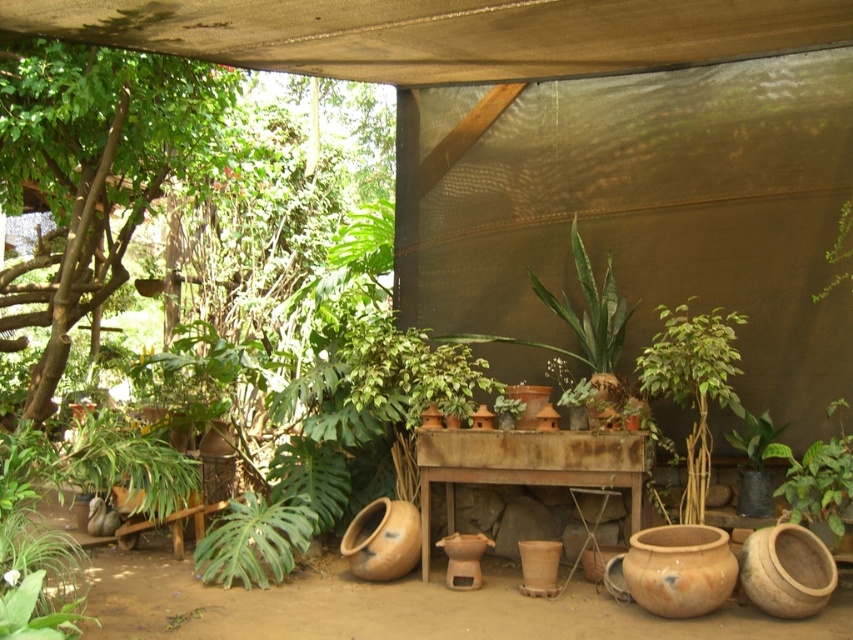
You are a gardener who needs to water the green leafy tree at left and the rusty metal table at center. Since the table is under the tree, will water from the tree above reach the table when it rains?

The green leafy tree at left is located above the rusty metal table at center, so yes, water from the tree above will reach the table when it rains.

You are a gardener who needs to move a tall ladder through the garden. The ladder is 2 meters tall. There is a green leafy tree at left and a rusty metal table at center. Which object might block the ladder if you move it directly under the shaded area?

The green leafy tree at left is taller than the rusty metal table at center, so the ladder might hit the green leafy tree at left when moving it under the shaded area because it is taller than the ladder height.

You are planning to place a new small potted plant between the green leafy tree at left and the rusty metal table at center. Based on their sizes, which object should the new plant be closer to?

The new small potted plant should be placed closer to the rusty metal table at center since the green leafy tree at left is bigger and may overshadow the smaller plant.